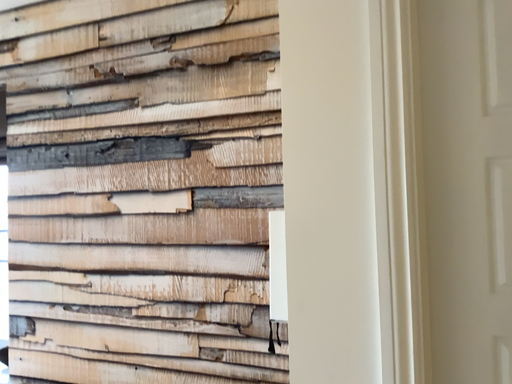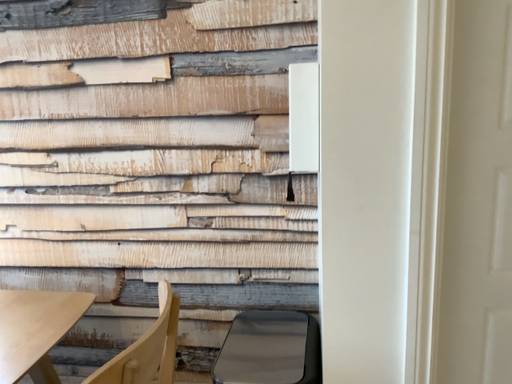
Question: Which way did the camera rotate in the video?

Choices:
 (A) rotated upward
 (B) rotated downward

Answer: (B)